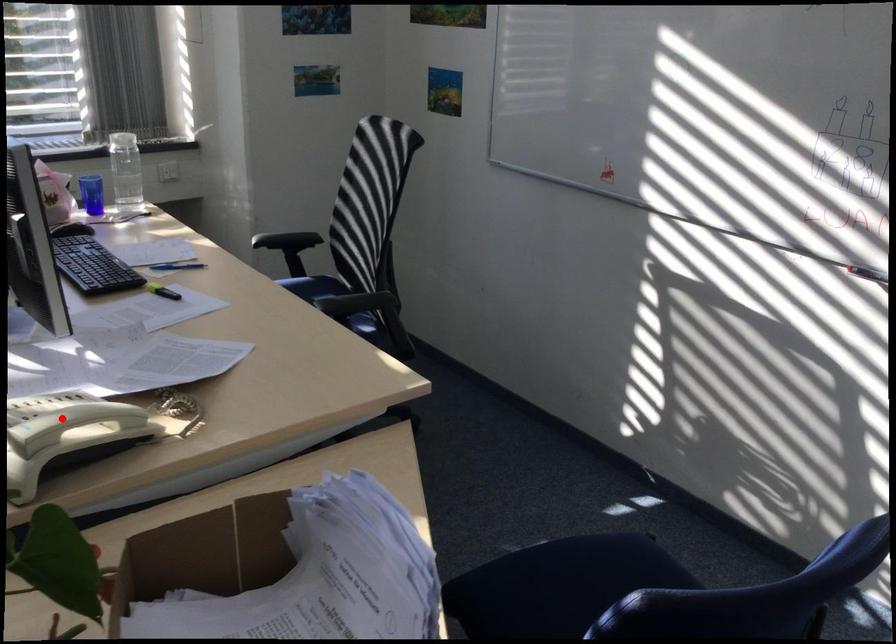
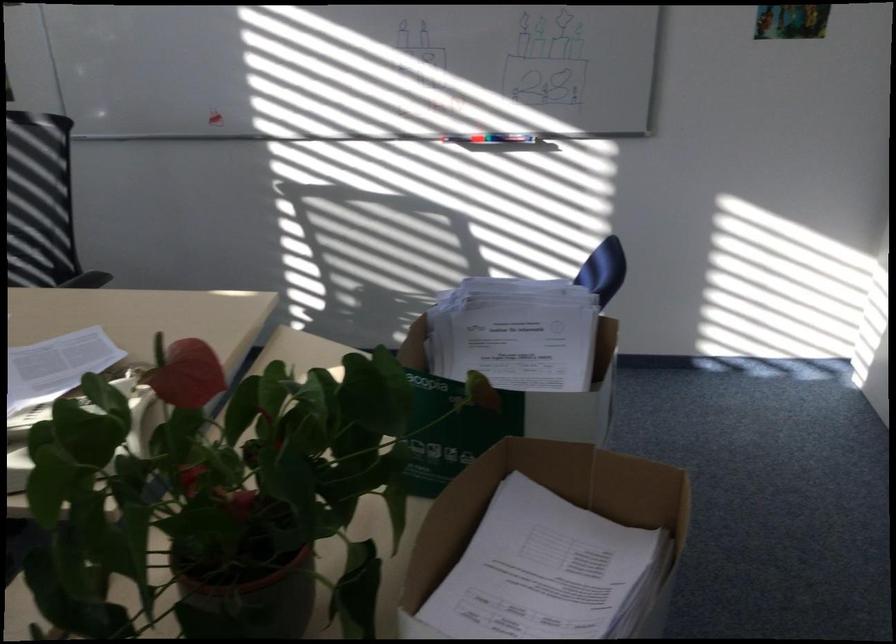
Question: I am providing you with two images of the same scene from different viewpoints. A red point is marked on the first image. Can you still see the location of the red point in image 2?

Choices:
 (A) Yes
 (B) No

Answer: (B)